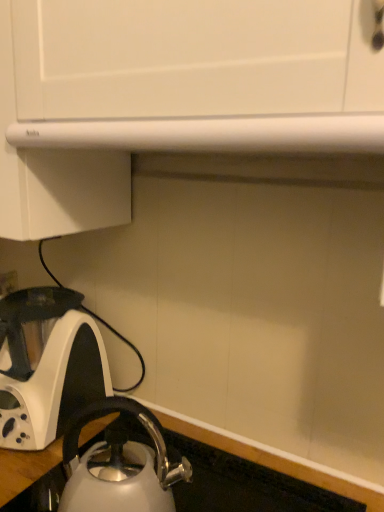
Question: From the image's perspective, does white glossy kettle at lower left, placed as the second kettle when sorted from right to left, appear lower than white glossy countertop at lower left?

Choices:
 (A) yes
 (B) no

Answer: (B)

Question: Is white glossy kettle at lower left, arranged as the first kettle when viewed from the left, bigger than white glossy countertop at lower left?

Choices:
 (A) no
 (B) yes

Answer: (B)

Question: Is white glossy kettle at lower left, arranged as the first kettle when viewed from the left, outside of white glossy countertop at lower left?

Choices:
 (A) yes
 (B) no

Answer: (A)

Question: Is white glossy kettle at lower left, placed as the second kettle when sorted from right to left, positioned behind white glossy countertop at lower left?

Choices:
 (A) no
 (B) yes

Answer: (B)

Question: Is white glossy countertop at lower left at the back of white glossy kettle at lower left, arranged as the first kettle when viewed from the left?

Choices:
 (A) no
 (B) yes

Answer: (A)

Question: Could white glossy countertop at lower left be considered to be inside white glossy kettle at lower left, arranged as the first kettle when viewed from the left?

Choices:
 (A) no
 (B) yes

Answer: (A)

Question: Is satin silver kettle at lower left, marked as the second kettle in a back-to-front arrangement, smaller than white glossy countertop at lower left?

Choices:
 (A) yes
 (B) no

Answer: (A)

Question: Is satin silver kettle at lower left, positioned as the 1th kettle in front-to-back order, thinner than white glossy countertop at lower left?

Choices:
 (A) yes
 (B) no

Answer: (A)

Question: Is satin silver kettle at lower left, which appears as the first kettle when viewed from the right, behind white glossy countertop at lower left?

Choices:
 (A) no
 (B) yes

Answer: (B)

Question: From a real-world perspective, does satin silver kettle at lower left, which appears as the first kettle when viewed from the right, sit lower than white glossy countertop at lower left?

Choices:
 (A) yes
 (B) no

Answer: (B)

Question: Can you see satin silver kettle at lower left, the second kettle when ordered from left to right, touching white glossy countertop at lower left?

Choices:
 (A) yes
 (B) no

Answer: (A)

Question: Is satin silver kettle at lower left, marked as the second kettle in a back-to-front arrangement, closer to the viewer compared to white glossy countertop at lower left?

Choices:
 (A) no
 (B) yes

Answer: (A)

Question: Is white glossy kettle at lower left, which is the first kettle from back to front, shorter than satin silver kettle at lower left, which appears as the first kettle when viewed from the right?

Choices:
 (A) yes
 (B) no

Answer: (B)